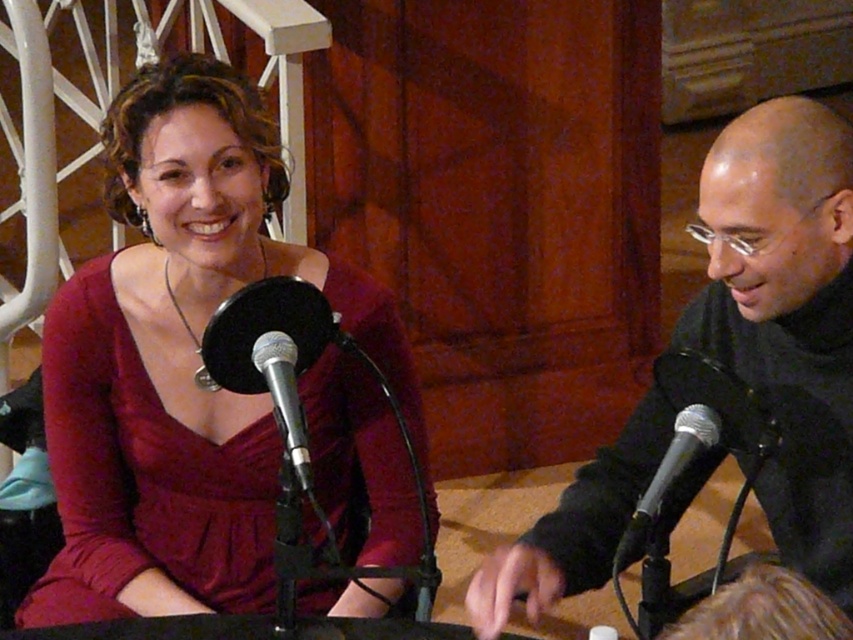
Looking at this image, you are a photographer setting up for a photoshoot and need to ensure that the matte red dress at center and the black matte jacket at right are both visible in the frame. Given that the camera has a fixed focal length, which object should you prioritize positioning closer to the camera to ensure both fit within the frame?

The matte red dress at center is wider than the black matte jacket at right. To ensure both fit within the frame, prioritize positioning the matte red dress at center closer to the camera since its greater width requires more space in the composition.

You are a photographer setting up for a photoshoot. You need to position a light source between the black matte jacket at right and the silver metallic microphone at center. Based on their positions, which object should the light be placed closer to?

The light source should be placed closer to the silver metallic microphone at center because the black matte jacket at right is positioned on the right side of the silver metallic microphone at center, meaning the microphone is to the left of the jacket. Therefore, placing the light closer to the microphone would ensure it illuminates both objects effectively while avoiding shadows from the jacket.